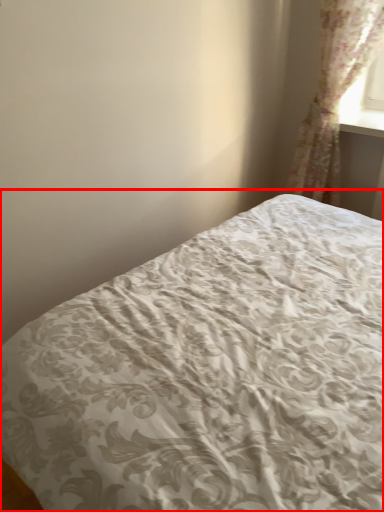
Question: Considering the relative positions of bed (annotated by the red box) and curtain in the image provided, where is bed (annotated by the red box) located with respect to the staircase?

Choices:
 (A) right
 (B) left

Answer: (B)